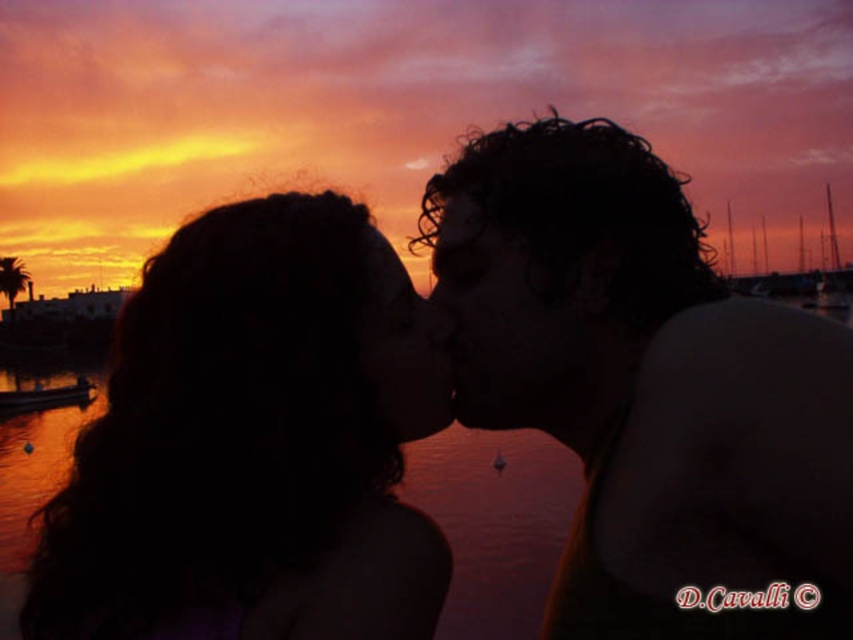
You are an artist observing the sunset scene. You notice two central features in the image, the dark curly hair at center and the smooth skin forehead at center. Which of these two features is located to the right of the other?

The dark curly hair at center is positioned on the right side of smooth skin forehead at center.